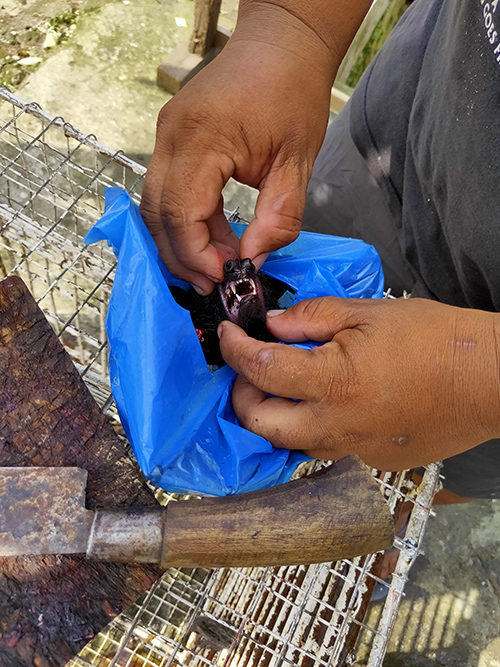
Identify the location of knife handle. (249, 537).